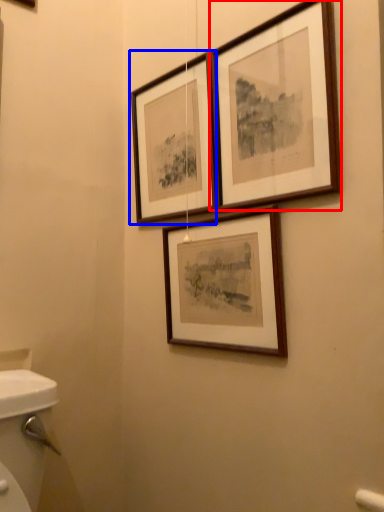
Question: Which object is further to the camera taking this photo, picture frame (highlighted by a red box) or picture frame (highlighted by a blue box)?

Choices:
 (A) picture frame
 (B) picture frame

Answer: (B)